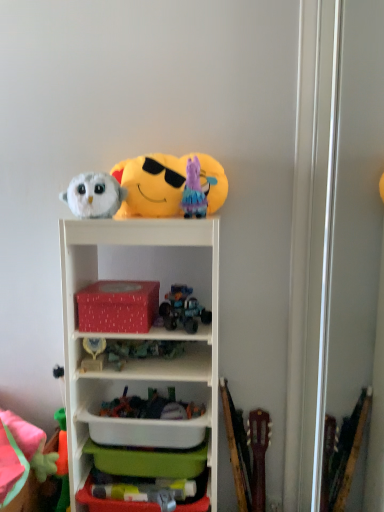
Question: From a real-world perspective, is soft plush emoji at upper center, the 7th toy when ordered from bottom to top, over red matte tissue box at center, the 1th storage box positioned from the top?

Choices:
 (A) no
 (B) yes

Answer: (B)

Question: Is soft plush emoji at upper center, the 7th toy when ordered from bottom to top, further to camera compared to red matte tissue box at center, the 1th storage box positioned from the top?

Choices:
 (A) yes
 (B) no

Answer: (A)

Question: Is soft plush emoji at upper center, the 7th toy when ordered from bottom to top, not close to red matte tissue box at center, the 1th storage box positioned from the top?

Choices:
 (A) yes
 (B) no

Answer: (B)

Question: Can you confirm if soft plush emoji at upper center, the 7th toy when ordered from bottom to top, is shorter than red matte tissue box at center, the 1th storage box positioned from the top?

Choices:
 (A) no
 (B) yes

Answer: (A)

Question: Can you confirm if soft plush emoji at upper center, the 7th toy when ordered from bottom to top, is wider than red matte tissue box at center, acting as the 2th storage box starting from the bottom?

Choices:
 (A) no
 (B) yes

Answer: (A)

Question: In the image, is fluffy white owl at upper left, which is counted as the third toy, starting from the top, on the left side or the right side of red matte tissue box at center, acting as the 2th storage box starting from the bottom?

Choices:
 (A) left
 (B) right

Answer: (A)

Question: Does point (104, 215) appear closer or farther from the camera than point (135, 321)?

Choices:
 (A) closer
 (B) farther

Answer: (A)

Question: Considering the positions of fluffy white owl at upper left, which is counted as the third toy, starting from the top, and red matte tissue box at center, the 1th storage box positioned from the top, in the image, is fluffy white owl at upper left, which is counted as the third toy, starting from the top, bigger or smaller than red matte tissue box at center, the 1th storage box positioned from the top,?

Choices:
 (A) big
 (B) small

Answer: (B)

Question: Considering the positions of fluffy white owl at upper left, which is counted as the third toy, starting from the top, and red matte tissue box at center, the 1th storage box positioned from the top, in the image, is fluffy white owl at upper left, which is counted as the third toy, starting from the top, wider or thinner than red matte tissue box at center, the 1th storage box positioned from the top,?

Choices:
 (A) thin
 (B) wide

Answer: (A)

Question: Is red matte tissue box at center, the 1th storage box positioned from the top, wider or thinner than white plastic container at center?

Choices:
 (A) thin
 (B) wide

Answer: (A)

Question: Relative to white plastic container at center, is red matte tissue box at center, the 1th storage box positioned from the top, in front or behind?

Choices:
 (A) behind
 (B) front

Answer: (A)

Question: In the image, is red matte tissue box at center, acting as the 2th storage box starting from the bottom, on the left side or the right side of white plastic container at center?

Choices:
 (A) right
 (B) left

Answer: (B)

Question: From a real-world perspective, is red matte tissue box at center, the 1th storage box positioned from the top, physically located above or below white plastic container at center?

Choices:
 (A) above
 (B) below

Answer: (A)

Question: Considering the positions of soft plush emoji at upper center, which appears as the 1th toy when viewed from the top, and gold metallic trophy at center, which ranks as the 5th toy in top-to-bottom order, in the image, is soft plush emoji at upper center, which appears as the 1th toy when viewed from the top, wider or thinner than gold metallic trophy at center, which ranks as the 5th toy in top-to-bottom order,?

Choices:
 (A) thin
 (B) wide

Answer: (B)

Question: Considering the positions of point (210, 201) and point (89, 348), is point (210, 201) closer or farther from the camera than point (89, 348)?

Choices:
 (A) closer
 (B) farther

Answer: (B)